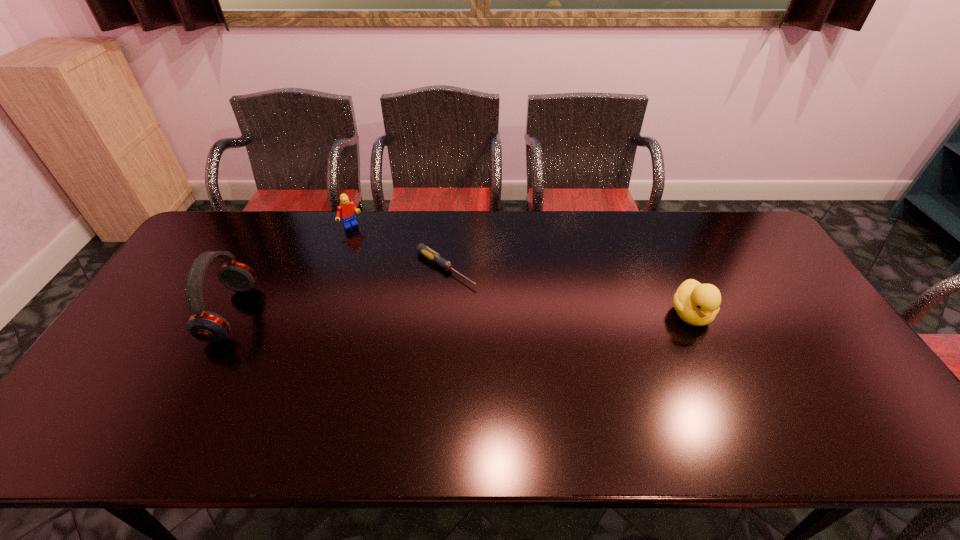
The image size is (960, 540). Find the location of `free space between the duck and the tallest object`. free space between the duck and the tallest object is located at coordinates (461, 314).

Locate an element on the screen. This screenshot has width=960, height=540. the second closest object relative to the leftmost object is located at coordinates (422, 249).

Where is `object that is the second closest to the leftmost object`? object that is the second closest to the leftmost object is located at coordinates (422, 249).